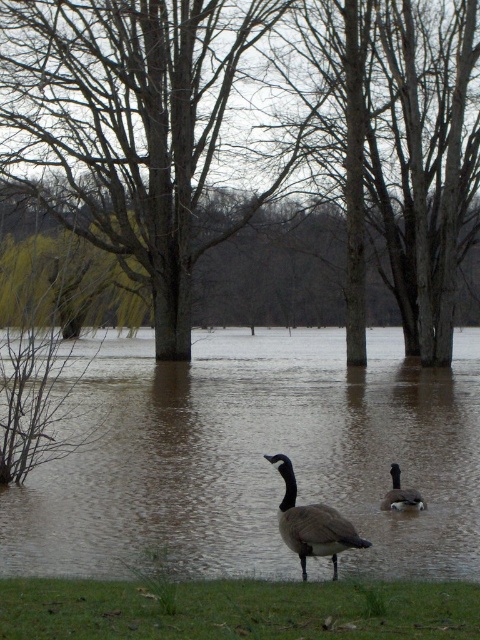
Who is lower down, brown murky water at center or gray matte goose at center?

Positioned lower is gray matte goose at center.

Is point (51, 557) in front of point (328, 508)?

That is False.

Locate an element on the screen. brown murky water at center is located at coordinates [x=255, y=458].

Where is `brown murky water at center`? The height and width of the screenshot is (640, 480). brown murky water at center is located at coordinates (255, 458).

Between gray matte goose at center and dark gray matte duck at center, which one appears on the right side from the viewer's perspective?

From the viewer's perspective, dark gray matte duck at center appears more on the right side.

Describe the element at coordinates (312, 524) in the screenshot. I see `gray matte goose at center` at that location.

Is point (302, 557) closer to camera compared to point (420, 509)?

That is True.

At what (x,y) coordinates should I click in order to perform the action: click on gray matte goose at center. Please return your answer as a coordinate pair (x, y). Looking at the image, I should click on (312, 524).

Who is taller, green grass at lower center or gray matte goose at center?

gray matte goose at center is taller.

Which is behind, point (389, 632) or point (315, 516)?

The point (315, 516) is more distant.

Locate an element on the screen. This screenshot has height=640, width=480. green grass at lower center is located at coordinates (238, 609).